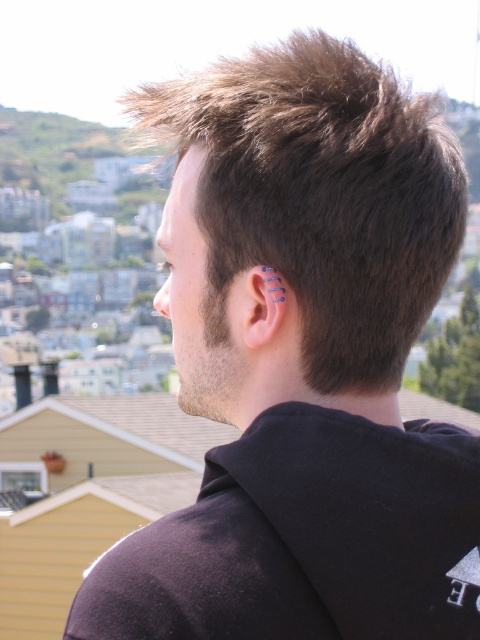
Is dark brown hair at upper center taller than blue metallic ear at center?

Yes, dark brown hair at upper center is taller than blue metallic ear at center.

Consider the image. Can you confirm if dark brown hair at upper center is shorter than blue metallic ear at center?

In fact, dark brown hair at upper center may be taller than blue metallic ear at center.

What do you see at coordinates (320, 196) in the screenshot? The height and width of the screenshot is (640, 480). I see `dark brown hair at upper center` at bounding box center [320, 196].

Identify the location of dark brown hair at upper center. Image resolution: width=480 pixels, height=640 pixels. (320, 196).

Is dark brown hair at upper center above black cotton sweatshirt at upper center?

Yes, dark brown hair at upper center is above black cotton sweatshirt at upper center.

Which is behind, point (335, 173) or point (84, 616)?

The point (335, 173) is behind.

This screenshot has height=640, width=480. Identify the location of dark brown hair at upper center. (320, 196).

Does black cotton sweatshirt at upper center appear on the right side of blue metallic ear at center?

Yes, black cotton sweatshirt at upper center is to the right of blue metallic ear at center.

Is black cotton sweatshirt at upper center shorter than blue metallic ear at center?

No.

Is point (159, 624) farther from viewer compared to point (256, 324)?

No, (159, 624) is closer to viewer.

I want to click on black cotton sweatshirt at upper center, so tap(304, 540).